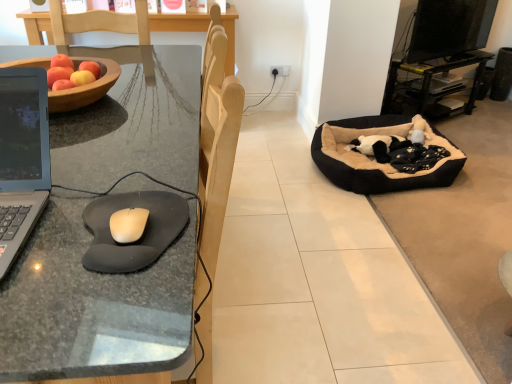
Find the location of a particular element. The width and height of the screenshot is (512, 384). free region under black foam mousepad at left (from a real-world perspective) is located at coordinates (153, 231).